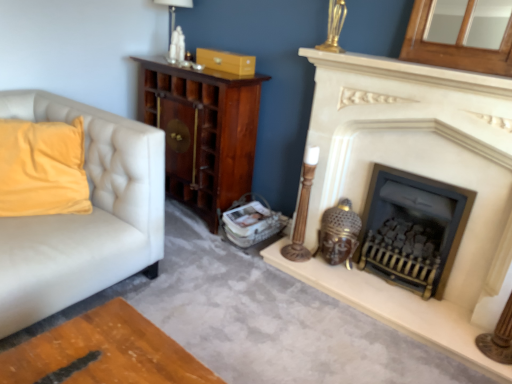
Image resolution: width=512 pixels, height=384 pixels. Identify the location of velvet yellow pillow at left. (42, 168).

What is the approximate height of black cast iron wood burning stove at center?

It is 23.41 inches.

What do you see at coordinates (226, 61) in the screenshot? I see `matte wood drawer at upper center` at bounding box center [226, 61].

Where is `dark wood cabinet at center`? The image size is (512, 384). dark wood cabinet at center is located at coordinates (202, 132).

Is dark wood cabinet at center to the left or to the right of matte white fireplace at right in the image?

dark wood cabinet at center is to the left of matte white fireplace at right.

Can you confirm if dark wood cabinet at center is bigger than matte white fireplace at right?

Indeed, dark wood cabinet at center has a larger size compared to matte white fireplace at right.

Which of these two, dark wood cabinet at center or matte white fireplace at right, is wider?

Wider between the two is dark wood cabinet at center.

Measure the distance between dark wood cabinet at center and matte white fireplace at right.

31.81 inches.

From the image's perspective, between matte wood drawer at upper center and velvet yellow pillow at left, who is located below?

velvet yellow pillow at left, from the image's perspective.

Which of these two, matte wood drawer at upper center or velvet yellow pillow at left, is smaller?

matte wood drawer at upper center is smaller.

Is matte wood drawer at upper center not inside velvet yellow pillow at left?

Indeed, matte wood drawer at upper center is completely outside velvet yellow pillow at left.

How far apart are matte wood drawer at upper center and velvet yellow pillow at left?

They are 37.79 inches apart.

Considering the sizes of objects black cast iron wood burning stove at center and velvet yellow pillow at left in the image provided, who is smaller, black cast iron wood burning stove at center or velvet yellow pillow at left?

With smaller size is black cast iron wood burning stove at center.

Is velvet yellow pillow at left surrounded by black cast iron wood burning stove at center?

No, velvet yellow pillow at left is located outside of black cast iron wood burning stove at center.

How many degrees apart are the facing directions of black cast iron wood burning stove at center and velvet yellow pillow at left?

The angle between the facing direction of black cast iron wood burning stove at center and the facing direction of velvet yellow pillow at left is 49.1 degrees.

Which is behind, black cast iron wood burning stove at center or velvet yellow pillow at left?

black cast iron wood burning stove at center is more distant.

Which point is more distant from viewer, (170, 21) or (441, 281)?

The point (170, 21) is behind.

How different are the orientations of white glossy table lamp at upper center and black cast iron wood burning stove at center in degrees?

1.1 degrees separate the facing orientations of white glossy table lamp at upper center and black cast iron wood burning stove at center.

From the picture: Does white glossy table lamp at upper center lie in front of black cast iron wood burning stove at center?

No, it is not.

Is white glossy table lamp at upper center facing away from black cast iron wood burning stove at center?

That's not correct — white glossy table lamp at upper center is not looking away from black cast iron wood burning stove at center.

From the picture: Is matte white fireplace at right wider than velvet yellow pillow at left?

Incorrect, the width of matte white fireplace at right does not surpass that of velvet yellow pillow at left.

Would you say matte white fireplace at right is a long distance from velvet yellow pillow at left?

Yes.

Which object is closer to the camera taking this photo, matte white fireplace at right or velvet yellow pillow at left?

matte white fireplace at right is in front.

Which of these two, matte white fireplace at right or velvet yellow pillow at left, is bigger?

matte white fireplace at right is bigger.

Could you tell me if matte white fireplace at right is facing matte wood drawer at upper center?

No, matte white fireplace at right is not aimed at matte wood drawer at upper center.

Does matte white fireplace at right have a smaller size compared to matte wood drawer at upper center?

No.

How different are the orientations of matte white fireplace at right and matte wood drawer at upper center in degrees?

There is a 0.00081-degree angle between the facing directions of matte white fireplace at right and matte wood drawer at upper center.

Which is behind, matte white fireplace at right or matte wood drawer at upper center?

matte wood drawer at upper center is behind.

Is point (66, 188) behind point (237, 64)?

No, it is not.

Is velvet yellow pillow at left inside or outside of matte wood drawer at upper center?

velvet yellow pillow at left is located beyond the bounds of matte wood drawer at upper center.

Is velvet yellow pillow at left wider than matte wood drawer at upper center?

Indeed, velvet yellow pillow at left has a greater width compared to matte wood drawer at upper center.

Considering the sizes of objects velvet yellow pillow at left and matte wood drawer at upper center in the image provided, who is smaller, velvet yellow pillow at left or matte wood drawer at upper center?

matte wood drawer at upper center.

Where is `fireplace on the right of the dark wood cabinet at center`? fireplace on the right of the dark wood cabinet at center is located at coordinates (418, 174).

Locate an element on the screen. Image resolution: width=512 pixels, height=384 pixels. pillow on the left of matte wood drawer at upper center is located at coordinates (42, 168).

Looking at the image, which one is located closer to black cast iron wood burning stove at center, matte wood drawer at upper center or dark wood cabinet at center?

The object closer to black cast iron wood burning stove at center is dark wood cabinet at center.

In the scene shown: Looking at the image, which one is located further to matte wood drawer at upper center, velvet yellow pillow at left or black cast iron wood burning stove at center?

black cast iron wood burning stove at center is further to matte wood drawer at upper center.

Which object lies further to the anchor point dark wood cabinet at center, velvet yellow pillow at left or white glossy table lamp at upper center?

Based on the image, velvet yellow pillow at left appears to be further to dark wood cabinet at center.

Based on their spatial positions, is matte white fireplace at right or velvet yellow pillow at left further from dark wood cabinet at center?

velvet yellow pillow at left lies further to dark wood cabinet at center than the other object.

Based on their spatial positions, is black cast iron wood burning stove at center or velvet yellow pillow at left further from matte white fireplace at right?

Based on the image, velvet yellow pillow at left appears to be further to matte white fireplace at right.

Based on their spatial positions, is matte wood drawer at upper center or white glossy table lamp at upper center further from velvet yellow pillow at left?

white glossy table lamp at upper center lies further to velvet yellow pillow at left than the other object.

Considering their positions, is matte white fireplace at right positioned closer to matte wood drawer at upper center than velvet yellow pillow at left?

matte white fireplace at right is positioned closer to the anchor matte wood drawer at upper center.

Looking at the image, which one is located closer to matte wood drawer at upper center, dark wood cabinet at center or white glossy table lamp at upper center?

Among the two, dark wood cabinet at center is located nearer to matte wood drawer at upper center.

Identify the location of fireplace between velvet yellow pillow at left and black cast iron wood burning stove at center from left to right. (418, 174).

Image resolution: width=512 pixels, height=384 pixels. Identify the location of cabinetry between white glossy table lamp at upper center and black cast iron wood burning stove at center. pos(202,132).

Locate an element on the screen. This screenshot has width=512, height=384. drawer located between velvet yellow pillow at left and matte white fireplace at right in the left-right direction is located at coordinates (226, 61).

You are a GUI agent. You are given a task and a screenshot of the screen. Output one action in this format:
    pyautogui.click(x=<x>, y=<y>)
    Task: Click on the cabinetry between white glossy table lamp at upper center and velvet yellow pillow at left from top to bottom
    Image resolution: width=512 pixels, height=384 pixels.
    Given the screenshot: What is the action you would take?
    pyautogui.click(x=202, y=132)